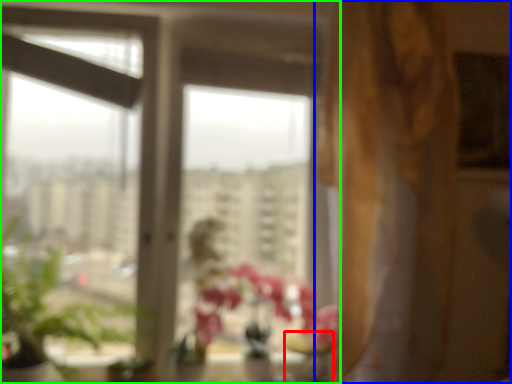
Question: Based on their relative distances, which object is farther from glass vase (highlighted by a red box)? Choose from curtain (highlighted by a blue box) and window (highlighted by a green box).

Choices:
 (A) curtain
 (B) window

Answer: (B)